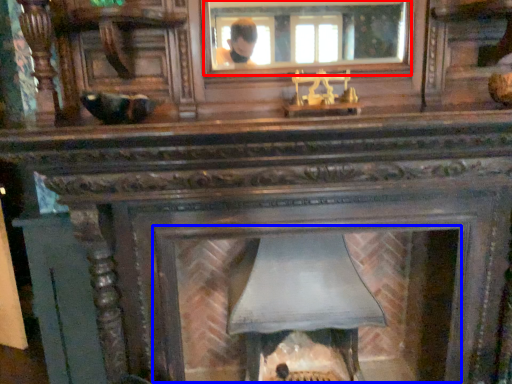
Question: Among these objects, which one is farthest to the camera, mirror (highlighted by a red box) or fireplace (highlighted by a blue box)?

Choices:
 (A) mirror
 (B) fireplace

Answer: (B)